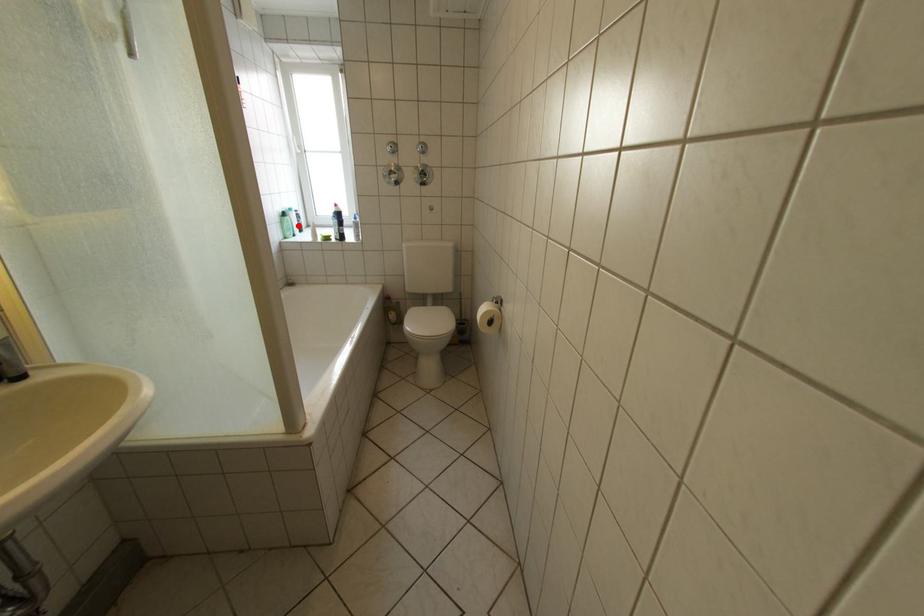
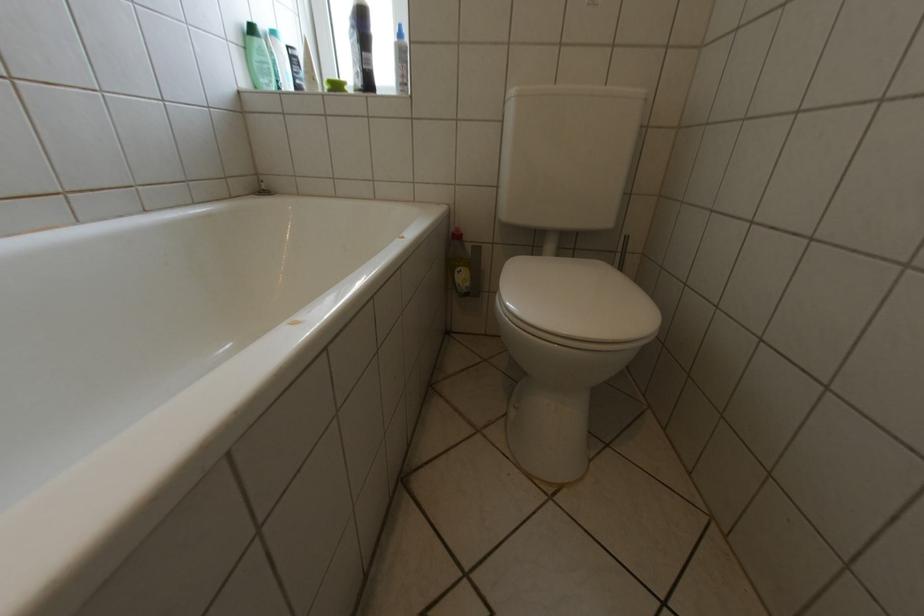
Question: I am providing you with two images of the same scene from different viewpoints. In image1, a red point is highlighted. Considering the same 3D point in image2, which of the following is correct?

Choices:
 (A) It is closer
 (B) It is farther

Answer: (B)